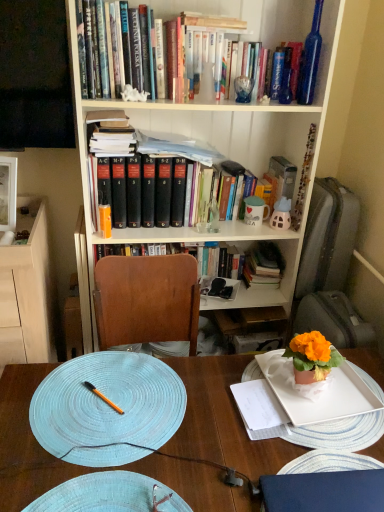
What are the coordinates of `white ceramic mug at upper center` in the screenshot? It's located at (255, 211).

At what (x,y) coordinates should I click in order to perform the action: click on blue woven placemat at center, which is the 3th plate from right to left. Please return your answer as a coordinate pair (x, y). This screenshot has width=384, height=512. Looking at the image, I should click on pyautogui.click(x=107, y=408).

Where is `white paper notebook at center`? white paper notebook at center is located at coordinates (258, 405).

Image resolution: width=384 pixels, height=512 pixels. What do you see at coordinates (35, 76) in the screenshot? I see `black glossy television at upper left` at bounding box center [35, 76].

This screenshot has width=384, height=512. I want to click on black glossy television at upper left, so click(x=35, y=76).

What do you see at coordinates (110, 495) in the screenshot?
I see `white woven placemat at lower center, the second plate when ordered from right to left` at bounding box center [110, 495].

The image size is (384, 512). Describe the element at coordinates (222, 419) in the screenshot. I see `blue woven placemat at center` at that location.

Locate an element on the screen. The width and height of the screenshot is (384, 512). white ceramic mug at upper center is located at coordinates (255, 211).

Which is correct: hardcover book at center is inside white paper notebook at center, or outside of it?

hardcover book at center is located beyond the bounds of white paper notebook at center.

Can you confirm if hardcover book at center is bigger than white paper notebook at center?

Yes.

Can you see hardcover book at center touching white paper notebook at center?

They are not placed beside each other.

From the image's perspective, which one is positioned higher, hardcover book at center or white paper notebook at center?

hardcover book at center, from the image's perspective.

Between blue woven placemat at center, which is the 3th plate from right to left, and white matte plate at lower right, the third plate positioned from the left, which one has larger size?

Bigger between the two is white matte plate at lower right, the third plate positioned from the left.

Which is in front, point (99, 463) or point (340, 418)?

Point (99, 463)

Can we say blue woven placemat at center, arranged as the 1th plate when viewed from the left, lies outside white matte plate at lower right, the third plate positioned from the left?

Absolutely, blue woven placemat at center, arranged as the 1th plate when viewed from the left, is external to white matte plate at lower right, the third plate positioned from the left.

Is blue woven placemat at center, which is the 3th plate from right to left, shorter than white matte plate at lower right, the third plate positioned from the left?

Yes.

Is blue woven placemat at center, arranged as the 1th plate when viewed from the left, with blue woven placemat at center?

Indeed, blue woven placemat at center, arranged as the 1th plate when viewed from the left, and blue woven placemat at center are beside each other and touching.

Considering the relative sizes of blue woven placemat at center, arranged as the 1th plate when viewed from the left, and blue woven placemat at center in the image provided, is blue woven placemat at center, arranged as the 1th plate when viewed from the left, smaller than blue woven placemat at center?

Yes.

Does blue woven placemat at center, which is the 3th plate from right to left, lie in front of blue woven placemat at center?

No, it is not.

Between orange glossy pen at center and white ceramic mug at upper center, which one has larger width?

white ceramic mug at upper center is wider.

Who is shorter, orange glossy pen at center or white ceramic mug at upper center?

orange glossy pen at center is shorter.

Consider the image. Which object is further away from the camera taking this photo, orange glossy pen at center or white ceramic mug at upper center?

Positioned behind is white ceramic mug at upper center.

In the scene shown: Are orange glossy pen at center and white ceramic mug at upper center located far from each other?

Indeed, orange glossy pen at center is not near white ceramic mug at upper center.

Between white paper notebook at center and white woven placemat at lower center, which ranks as the 2th plate in left-to-right order, which one has larger size?

white woven placemat at lower center, which ranks as the 2th plate in left-to-right order.

Considering the relative positions of white paper notebook at center and white woven placemat at lower center, the second plate when ordered from right to left, in the image provided, is white paper notebook at center in front of white woven placemat at lower center, the second plate when ordered from right to left,?

No, white paper notebook at center is further to the viewer.

Is white woven placemat at lower center, which ranks as the 2th plate in left-to-right order, a part of white paper notebook at center?

No, white woven placemat at lower center, which ranks as the 2th plate in left-to-right order, is not inside white paper notebook at center.

From the picture: Which is more to the left, white paper notebook at center or white woven placemat at lower center, which ranks as the 2th plate in left-to-right order?

white woven placemat at lower center, which ranks as the 2th plate in left-to-right order, is more to the left.

Is the surface of light wood cabinet at left in direct contact with white ceramic mug at upper center?

No, light wood cabinet at left is not making contact with white ceramic mug at upper center.

From a real-world perspective, is light wood cabinet at left physically below white ceramic mug at upper center?

Yes.

Would you say light wood cabinet at left contains white ceramic mug at upper center?

That's incorrect, white ceramic mug at upper center is not inside light wood cabinet at left.

Is white matte bookcase at upper center directly adjacent to black glossy television at upper left?

No, white matte bookcase at upper center is not in contact with black glossy television at upper left.

Considering the relative positions of white matte bookcase at upper center and black glossy television at upper left in the image provided, is white matte bookcase at upper center to the left or to the right of black glossy television at upper left?

In the image, white matte bookcase at upper center appears on the right side of black glossy television at upper left.

Considering the relative sizes of white matte bookcase at upper center and black glossy television at upper left in the image provided, is white matte bookcase at upper center wider than black glossy television at upper left?

Yes.

In the scene shown: From the image's perspective, relative to black glossy television at upper left, is white matte bookcase at upper center above or below?

white matte bookcase at upper center is below black glossy television at upper left.

The width and height of the screenshot is (384, 512). I want to click on notebook that is above the hardcover book at center (from a real-world perspective), so click(258, 405).

Locate an element on the screen. This screenshot has height=512, width=384. plate that is the 1st object located in front of the white matte plate at lower right, the third plate positioned from the left is located at coordinates (107, 408).

Considering their positions, is black glossy television at upper left positioned further to blue woven placemat at center, arranged as the 1th plate when viewed from the left, than white ceramic mug at upper center?

black glossy television at upper left is positioned further to the anchor blue woven placemat at center, arranged as the 1th plate when viewed from the left.

When comparing their distances from orange glossy pen at center, does black glossy television at upper left or white matte plate at lower right, the third plate positioned from the left, seem further?

black glossy television at upper left is further to orange glossy pen at center.

Looking at the image, which one is located further to hardcover book at center, light wood cabinet at left or white woven placemat at lower center, which ranks as the 2th plate in left-to-right order?

white woven placemat at lower center, which ranks as the 2th plate in left-to-right order, is further to hardcover book at center.

Based on their spatial positions, is white paper notebook at center or white woven placemat at lower center, which ranks as the 2th plate in left-to-right order, further from white ceramic mug at upper center?

white woven placemat at lower center, which ranks as the 2th plate in left-to-right order.

Considering their positions, is white matte bookcase at upper center positioned closer to blue woven placemat at center, arranged as the 1th plate when viewed from the left, than white paper notebook at center?

The object closer to blue woven placemat at center, arranged as the 1th plate when viewed from the left, is white paper notebook at center.

Based on their spatial positions, is light wood cabinet at left or black glossy television at upper left further from orange glossy pen at center?

Based on the image, black glossy television at upper left appears to be further to orange glossy pen at center.

Estimate the real-world distances between objects in this image. Which object is closer to white woven placemat at lower center, the second plate when ordered from right to left, light wood cabinet at left or white paper notebook at center?

white paper notebook at center is closer to white woven placemat at lower center, the second plate when ordered from right to left.

Estimate the real-world distances between objects in this image. Which object is closer to orange glossy pen at center, light wood cabinet at left or blue woven placemat at center?

blue woven placemat at center is positioned closer to the anchor orange glossy pen at center.

Find the location of a particular element. notebook between blue woven placemat at center, arranged as the 1th plate when viewed from the left, and hardcover book at center, along the z-axis is located at coordinates (258, 405).

Image resolution: width=384 pixels, height=512 pixels. Find the location of `tableware between white matte bookcase at upper center and hardcover book at center along the z-axis`. tableware between white matte bookcase at upper center and hardcover book at center along the z-axis is located at coordinates (255, 211).

Locate an element on the screen. Image resolution: width=384 pixels, height=512 pixels. notebook between white matte plate at lower right, acting as the 1th plate starting from the right, and white ceramic mug at upper center, along the z-axis is located at coordinates (258, 405).

Locate an element on the screen. The image size is (384, 512). notebook between white matte bookcase at upper center and blue woven placemat at center vertically is located at coordinates (258, 405).